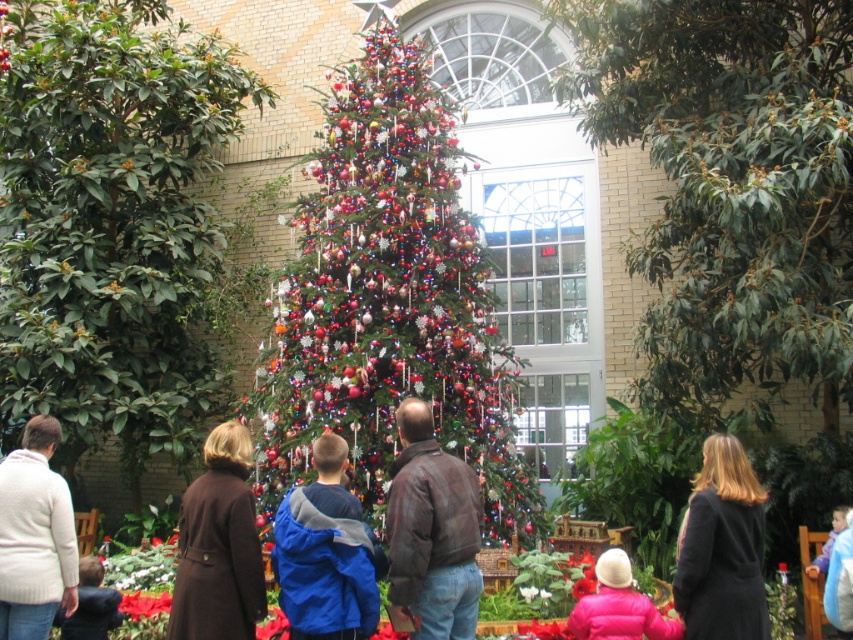
Can you confirm if green leafy tree at center is positioned to the right of knit white sweater at lower left?

Yes, green leafy tree at center is to the right of knit white sweater at lower left.

Between green leafy tree at center and knit white sweater at lower left, which one appears on the left side from the viewer's perspective?

From the viewer's perspective, knit white sweater at lower left appears more on the left side.

Who is more distant from viewer, [628,104] or [41,476]?

Positioned behind is point [628,104].

The width and height of the screenshot is (853, 640). Identify the location of green leafy tree at center. (x=730, y=186).

Who is taller, brown leather jacket at center or dark blue jacket at lower left?

brown leather jacket at center

Where is `brown leather jacket at center`? This screenshot has width=853, height=640. brown leather jacket at center is located at coordinates (432, 531).

Which is below, green leafy tree at center or pink matte jacket at lower center?

Positioned lower is pink matte jacket at lower center.

Can you confirm if green leafy tree at center is shorter than pink matte jacket at lower center?

In fact, green leafy tree at center may be taller than pink matte jacket at lower center.

Describe the element at coordinates (730, 186) in the screenshot. I see `green leafy tree at center` at that location.

At what (x,y) coordinates should I click in order to perform the action: click on green leafy tree at center. Please return your answer as a coordinate pair (x, y). Looking at the image, I should click on (730, 186).